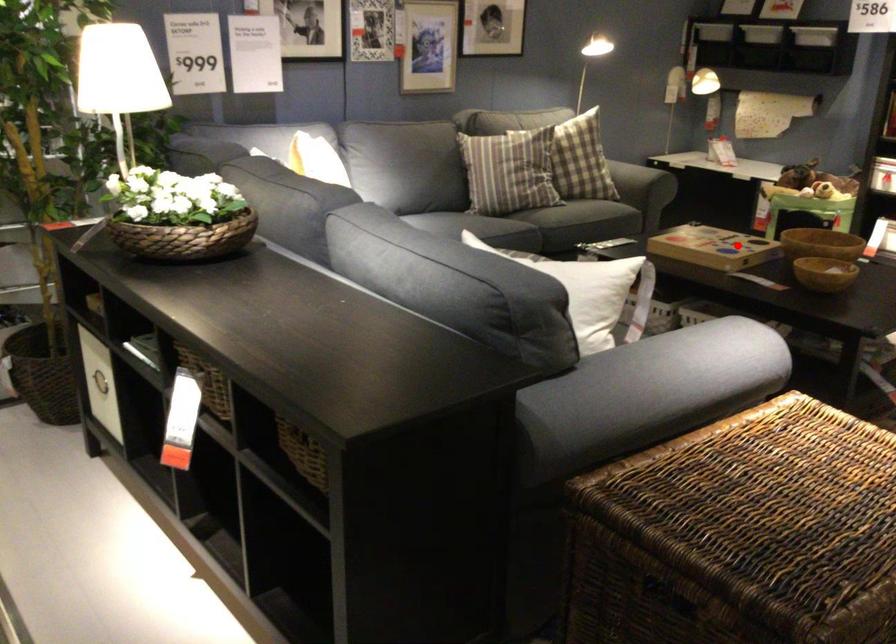
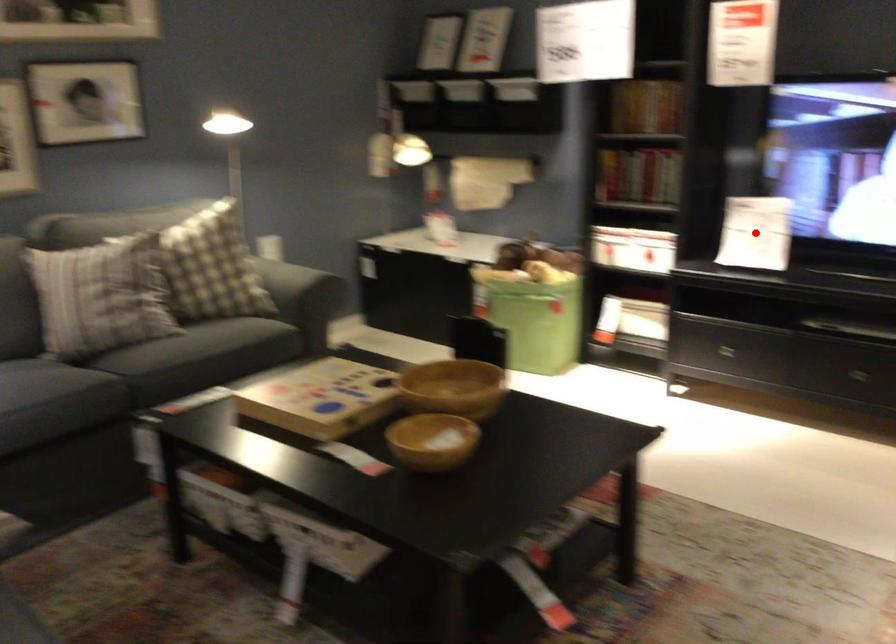
I am providing you with two images of the same scene from different viewpoints. A red point is marked on the first image and another point is marked on the second image. Is the red point in image1 aligned with the point shown in image2?

No